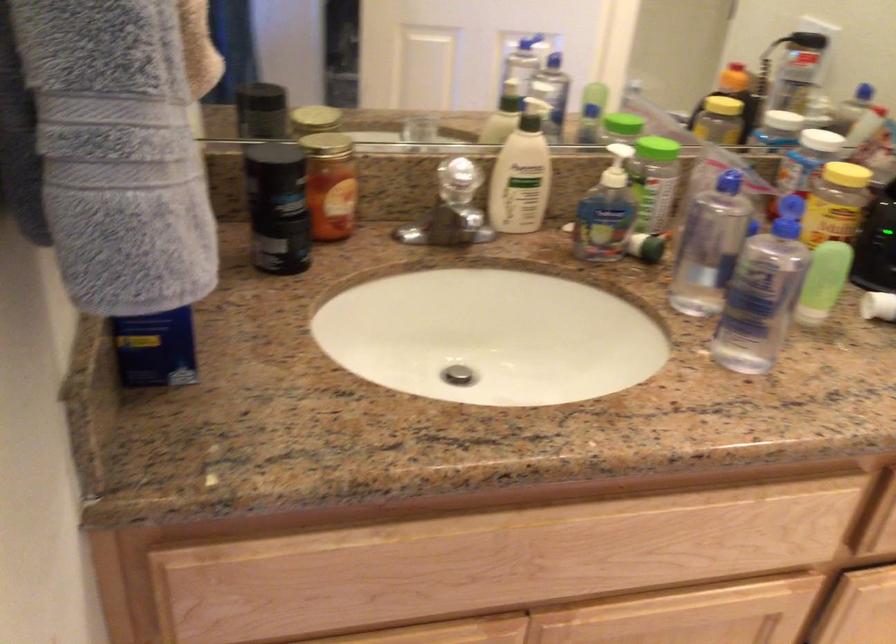
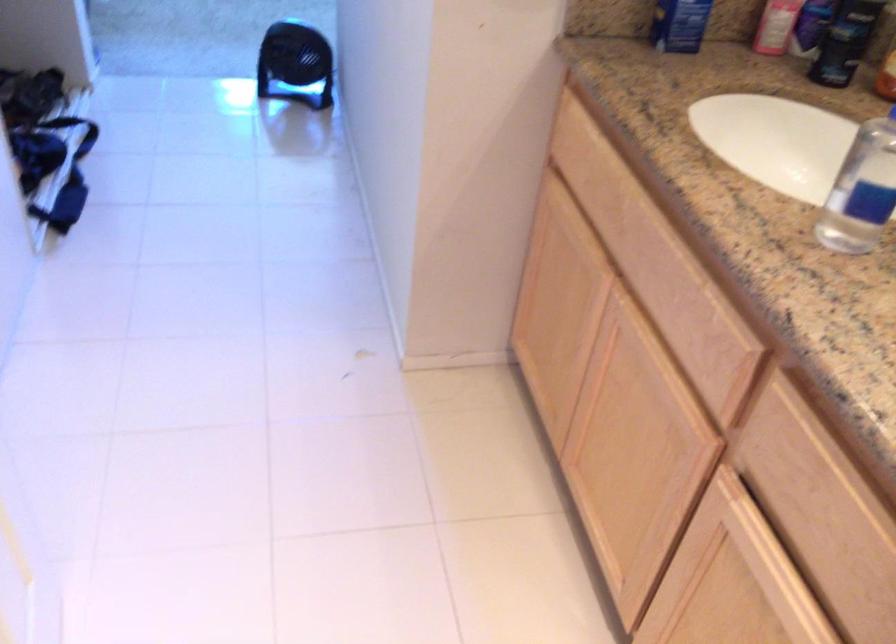
In the second image, find the point that corresponds to (314,207) in the first image.

(845, 41)